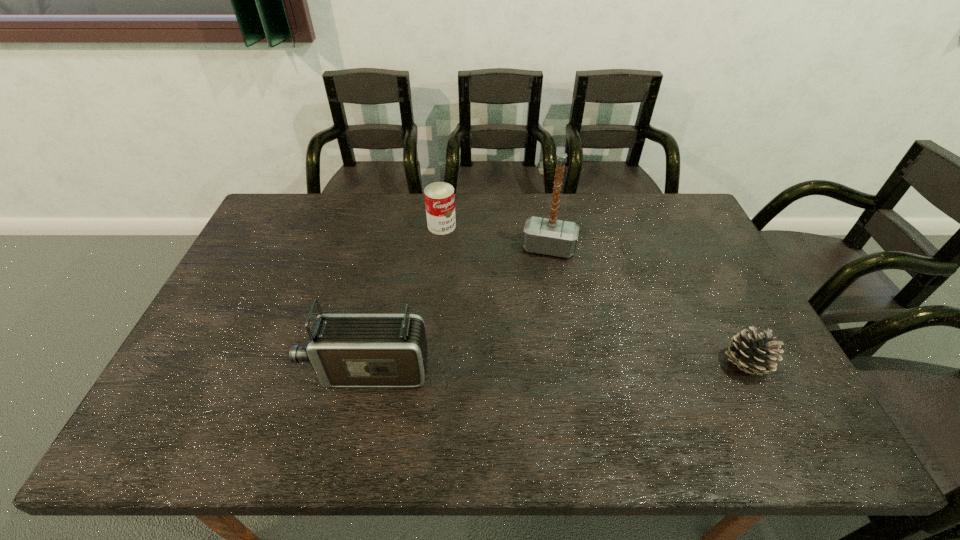
Image resolution: width=960 pixels, height=540 pixels. In order to click on the second tallest object in this screenshot , I will do `click(345, 350)`.

Locate an element on the screen. This screenshot has height=540, width=960. the shortest object is located at coordinates (753, 354).

Where is `pinecone`? pinecone is located at coordinates (753, 354).

Where is `the second farthest object`? Image resolution: width=960 pixels, height=540 pixels. the second farthest object is located at coordinates (549, 236).

Identify the location of the tallest object. (549, 236).

The height and width of the screenshot is (540, 960). I want to click on the farthest object, so click(x=439, y=197).

Where is `can`? The width and height of the screenshot is (960, 540). can is located at coordinates pyautogui.click(x=439, y=197).

At what (x,y) coordinates should I click in order to perform the action: click on free region located at the lens of the camcorder. Please return your answer as a coordinate pair (x, y). The height and width of the screenshot is (540, 960). Looking at the image, I should click on (255, 370).

Identify the location of vacant region located at the lens of the camcorder. The width and height of the screenshot is (960, 540). click(252, 370).

Where is `vacant area situated at the lens of the camcorder`? vacant area situated at the lens of the camcorder is located at coordinates (179, 370).